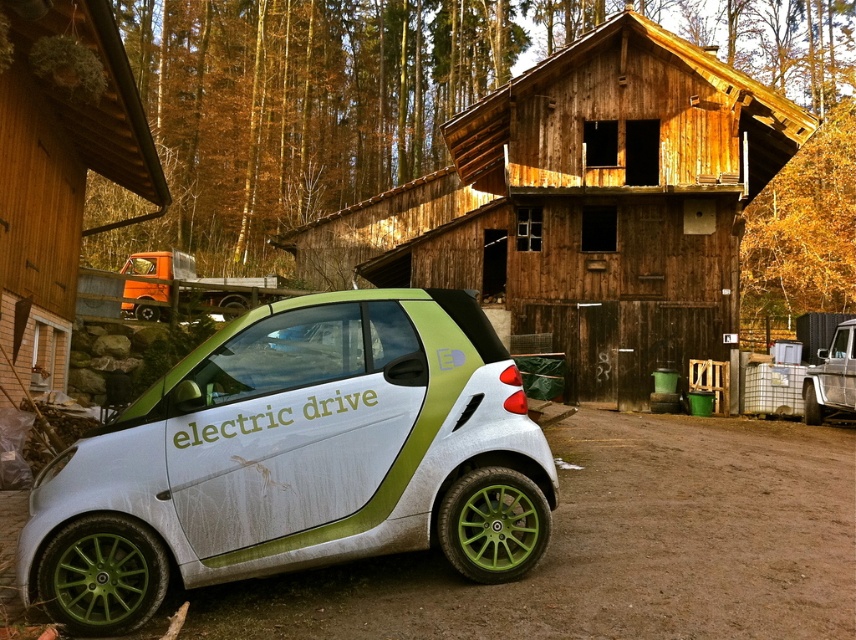
Based on the photo, can you confirm if silver metallic car at center is smaller than wooden cabin at center?

Yes.

Between silver metallic car at center and wooden cabin at center, which one is positioned lower?

Positioned lower is silver metallic car at center.

Is point (180, 524) positioned behind point (746, 173)?

No.

I want to click on silver metallic car at center, so click(x=296, y=460).

Which of these two, wooden cabin at center or orange matte truck at left, stands taller?

wooden cabin at center is taller.

Who is lower down, wooden cabin at center or orange matte truck at left?

orange matte truck at left

Between point (474, 150) and point (94, 138), which one is positioned behind?

The point (474, 150) is behind.

Find the location of a particular element. wooden cabin at center is located at coordinates (586, 204).

Does wooden cabin at center appear on the left side of white matte dirt track at center?

Incorrect, wooden cabin at center is not on the left side of white matte dirt track at center.

Between wooden cabin at center and white matte dirt track at center, which one has less height?

With less height is white matte dirt track at center.

You are a GUI agent. You are given a task and a screenshot of the screen. Output one action in this format:
    pyautogui.click(x=<x>, y=<y>)
    Task: Click on the wooden cabin at center
    Image resolution: width=856 pixels, height=640 pixels.
    Given the screenshot: What is the action you would take?
    pyautogui.click(x=586, y=204)

You are a GUI agent. You are given a task and a screenshot of the screen. Output one action in this format:
    pyautogui.click(x=<x>, y=<y>)
    Task: Click on the wooden cabin at center
    Image resolution: width=856 pixels, height=640 pixels.
    Given the screenshot: What is the action you would take?
    pyautogui.click(x=586, y=204)